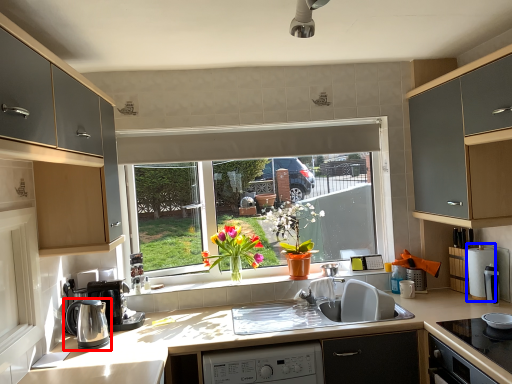
Question: Which object is closer to the camera taking this photo, kitchen appliance (highlighted by a red box) or appliance (highlighted by a blue box)?

Choices:
 (A) kitchen appliance
 (B) appliance

Answer: (A)